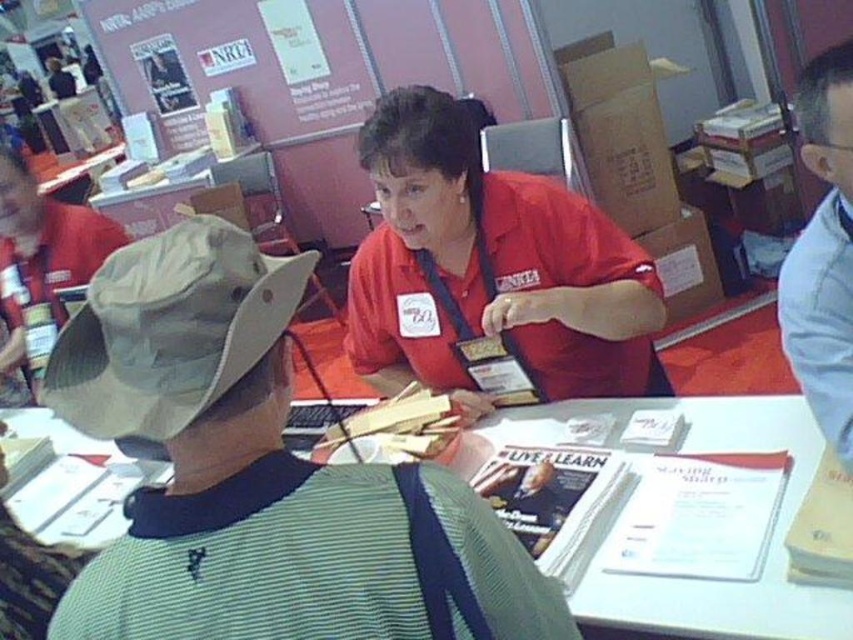
Question: Does matte red shirt at center have a lesser width compared to matte red bulletin board at upper center?

Choices:
 (A) no
 (B) yes

Answer: (B)

Question: Which of the following is the closest to the observer?

Choices:
 (A) (839, 115)
 (B) (106, 349)

Answer: (B)

Question: Based on their relative distances, which object is farther from the matte red shirt at center?

Choices:
 (A) tan fabric hat at left
 (B) white paper at center

Answer: (A)

Question: Which point is closer to the camera taking this photo?

Choices:
 (A) (74, 580)
 (B) (498, 65)
 (C) (170, 346)

Answer: (C)

Question: Can you confirm if tan fabric hat at left is smaller than white shirt at upper right?

Choices:
 (A) yes
 (B) no

Answer: (A)

Question: Does matte red bulletin board at upper center lie in front of khaki fabric hat at upper left?

Choices:
 (A) no
 (B) yes

Answer: (A)